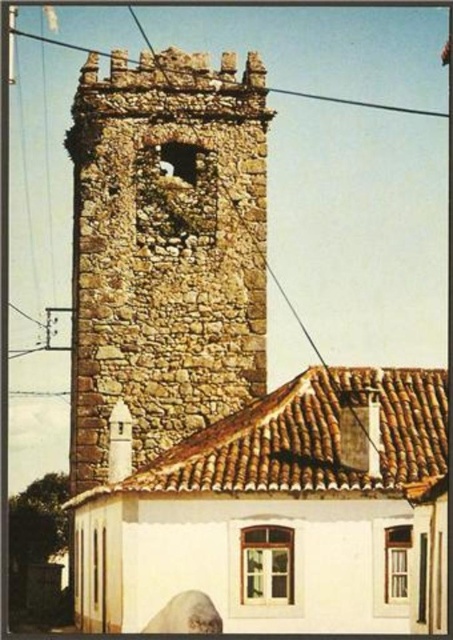
You are standing at the base of the brown stone tower at center and want to take a photo of it. The camera you have can focus on objects up to 100 meters away. Will the camera be able to capture the tower clearly?

The brown stone tower at center and camera are 74.96 meters apart, which is within the camera focus range of 100 meters. Therefore, the camera can capture the tower clearly.

You are a drone operator trying to fly a drone through the space between the brown stone tower at center and the metallic wire at upper center. According to the image, can the drone pass through that space?

The brown stone tower at center is in front of the metallic wire at upper center, so the drone cannot pass through the space between them because the tower blocks the path.

What are the coordinates of the brown stone tower at center in the image?

The brown stone tower at center is located at coordinates point [164,250].